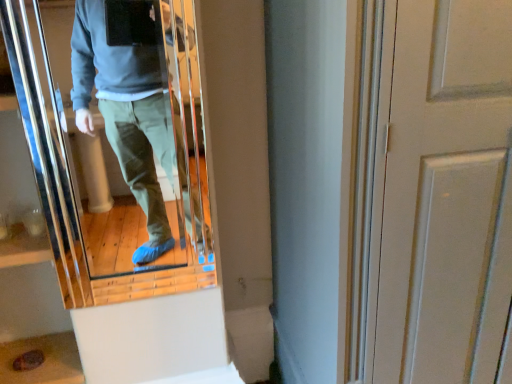
Question: Considering the positions of white matte door at center right and matte glass mirror at center in the image, is white matte door at center right bigger or smaller than matte glass mirror at center?

Choices:
 (A) big
 (B) small

Answer: (A)

Question: From the image's perspective, is white matte door at center right positioned above or below matte glass mirror at center?

Choices:
 (A) below
 (B) above

Answer: (A)

Question: Is white matte door at center right to the left or to the right of matte glass mirror at center in the image?

Choices:
 (A) right
 (B) left

Answer: (A)

Question: Considering the positions of matte glass mirror at center and white matte door at center right in the image, is matte glass mirror at center taller or shorter than white matte door at center right?

Choices:
 (A) short
 (B) tall

Answer: (A)

Question: Is matte glass mirror at center wider or thinner than white matte door at center right?

Choices:
 (A) thin
 (B) wide

Answer: (A)

Question: Visually, is matte glass mirror at center positioned to the left or to the right of white matte door at center right?

Choices:
 (A) right
 (B) left

Answer: (B)

Question: Is matte glass mirror at center in front of or behind white matte door at center right in the image?

Choices:
 (A) behind
 (B) front

Answer: (A)